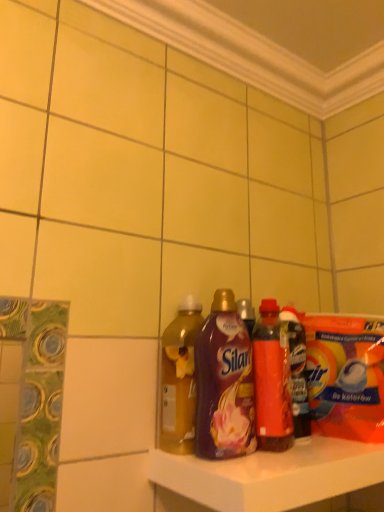
In order to face shiny plastic bottle at center, the 2th bottle when ordered from right to left, should I rotate leftwards or rightwards?

To face it directly, rotate right by 10.706 degrees.

Identify the location of shiny plastic bottle at center, the third bottle when ordered from left to right. Image resolution: width=384 pixels, height=512 pixels. 272,381.

The height and width of the screenshot is (512, 384). I want to click on translucent yellow liquid at center, arranged as the 4th bottle when viewed from the right, so click(x=179, y=379).

From the image's perspective, which one is positioned lower, purple plastic bottle at center, which ranks as the 3th bottle in right-to-left order, or shiny plastic bottle at center, the 2th bottle when ordered from right to left?

shiny plastic bottle at center, the 2th bottle when ordered from right to left, is shown below in the image.

Is purple plastic bottle at center, which ranks as the 3th bottle in right-to-left order, next to shiny plastic bottle at center, the 2th bottle when ordered from right to left?

Yes, purple plastic bottle at center, which ranks as the 3th bottle in right-to-left order, is next to shiny plastic bottle at center, the 2th bottle when ordered from right to left.

How many degrees apart are the facing directions of purple plastic bottle at center, which ranks as the 3th bottle in right-to-left order, and shiny plastic bottle at center, the third bottle when ordered from left to right?

1.74e-05 degrees separate the facing orientations of purple plastic bottle at center, which ranks as the 3th bottle in right-to-left order, and shiny plastic bottle at center, the third bottle when ordered from left to right.

Looking at their sizes, would you say purple plastic bottle at center, which ranks as the 3th bottle in right-to-left order, is wider or thinner than shiny plastic bottle at center, the third bottle when ordered from left to right?

In the image, purple plastic bottle at center, which ranks as the 3th bottle in right-to-left order, appears to be more narrow than shiny plastic bottle at center, the third bottle when ordered from left to right.

How different are the orientations of shiny plastic bottle at center, the 2th bottle when ordered from right to left, and translucent yellow liquid at center, arranged as the 4th bottle when viewed from the right, in degrees?

There is a 1.71e-05-degree angle between the facing directions of shiny plastic bottle at center, the 2th bottle when ordered from right to left, and translucent yellow liquid at center, arranged as the 4th bottle when viewed from the right.

Considering the positions of objects shiny plastic bottle at center, the 2th bottle when ordered from right to left, and translucent yellow liquid at center, placed as the first bottle when sorted from left to right, in the image provided, who is behind, shiny plastic bottle at center, the 2th bottle when ordered from right to left, or translucent yellow liquid at center, placed as the first bottle when sorted from left to right,?

Positioned behind is shiny plastic bottle at center, the 2th bottle when ordered from right to left.

Can we say shiny plastic bottle at center, the 2th bottle when ordered from right to left, lies outside translucent yellow liquid at center, arranged as the 4th bottle when viewed from the right?

Indeed, shiny plastic bottle at center, the 2th bottle when ordered from right to left, is completely outside translucent yellow liquid at center, arranged as the 4th bottle when viewed from the right.

Which bottle is the 1st one when counting from the front of the shiny plastic bottle at center, the third bottle when ordered from left to right? Please provide its 2D coordinates.

[(179, 379)]

Based on the photo, which is closer, (277, 411) or (281, 320)?

The point (277, 411) is more forward.

Is shiny plastic bottle at center, the 2th bottle when ordered from right to left, taller than translucent plastic bottle at center, placed as the 1th bottle when sorted from right to left?

Indeed, shiny plastic bottle at center, the 2th bottle when ordered from right to left, has a greater height compared to translucent plastic bottle at center, placed as the 1th bottle when sorted from right to left.

Considering the sizes of objects shiny plastic bottle at center, the third bottle when ordered from left to right, and translucent plastic bottle at center, placed as the 1th bottle when sorted from right to left, in the image provided, who is wider, shiny plastic bottle at center, the third bottle when ordered from left to right, or translucent plastic bottle at center, placed as the 1th bottle when sorted from right to left,?

With larger width is shiny plastic bottle at center, the third bottle when ordered from left to right.

Is shiny plastic bottle at center, the third bottle when ordered from left to right, placed right next to translucent plastic bottle at center, which is counted as the 4th bottle, starting from the left?

Yes, shiny plastic bottle at center, the third bottle when ordered from left to right, and translucent plastic bottle at center, which is counted as the 4th bottle, starting from the left, clearly make contact.

Identify the location of bottle to the left of purple plastic bottle at center, the second bottle in the left-to-right sequence. (179, 379).

Is translucent yellow liquid at center, arranged as the 4th bottle when viewed from the right, looking in the opposite direction of purple plastic bottle at center, the second bottle in the left-to-right sequence?

No, translucent yellow liquid at center, arranged as the 4th bottle when viewed from the right, is not facing the opposite direction of purple plastic bottle at center, the second bottle in the left-to-right sequence.

From the picture: From a real-world perspective, which object rests below the other?

translucent yellow liquid at center, placed as the first bottle when sorted from left to right, from a real-world perspective.

From the image's perspective, which is above, translucent yellow liquid at center, placed as the first bottle when sorted from left to right, or purple plastic bottle at center, the second bottle in the left-to-right sequence?

purple plastic bottle at center, the second bottle in the left-to-right sequence.

In the image, is translucent plastic bottle at center, which is counted as the 4th bottle, starting from the left, on the left side or the right side of translucent yellow liquid at center, placed as the first bottle when sorted from left to right?

Clearly, translucent plastic bottle at center, which is counted as the 4th bottle, starting from the left, is on the right of translucent yellow liquid at center, placed as the first bottle when sorted from left to right, in the image.

In the scene shown: How many degrees apart are the facing directions of translucent plastic bottle at center, which is counted as the 4th bottle, starting from the left, and translucent yellow liquid at center, placed as the first bottle when sorted from left to right?

0.000131 degrees separate the facing orientations of translucent plastic bottle at center, which is counted as the 4th bottle, starting from the left, and translucent yellow liquid at center, placed as the first bottle when sorted from left to right.

Considering the sizes of translucent plastic bottle at center, placed as the 1th bottle when sorted from right to left, and translucent yellow liquid at center, arranged as the 4th bottle when viewed from the right, in the image, is translucent plastic bottle at center, placed as the 1th bottle when sorted from right to left, taller or shorter than translucent yellow liquid at center, arranged as the 4th bottle when viewed from the right,?

Clearly, translucent plastic bottle at center, placed as the 1th bottle when sorted from right to left, is taller compared to translucent yellow liquid at center, arranged as the 4th bottle when viewed from the right.

Does point (299, 348) come farther from viewer compared to point (175, 438)?

That is True.

How different are the orientations of shiny plastic bottle at center, the third bottle when ordered from left to right, and purple plastic bottle at center, which ranks as the 3th bottle in right-to-left order, in degrees?

There is a 1.74e-05-degree angle between the facing directions of shiny plastic bottle at center, the third bottle when ordered from left to right, and purple plastic bottle at center, which ranks as the 3th bottle in right-to-left order.

Is shiny plastic bottle at center, the 2th bottle when ordered from right to left, in contact with purple plastic bottle at center, which ranks as the 3th bottle in right-to-left order?

Yes, shiny plastic bottle at center, the 2th bottle when ordered from right to left, is beside purple plastic bottle at center, which ranks as the 3th bottle in right-to-left order.

Between shiny plastic bottle at center, the 2th bottle when ordered from right to left, and purple plastic bottle at center, which ranks as the 3th bottle in right-to-left order, which one is positioned behind?

Positioned behind is shiny plastic bottle at center, the 2th bottle when ordered from right to left.

Measure the distance from shiny plastic bottle at center, the third bottle when ordered from left to right, to purple plastic bottle at center, which ranks as the 3th bottle in right-to-left order.

shiny plastic bottle at center, the third bottle when ordered from left to right, and purple plastic bottle at center, which ranks as the 3th bottle in right-to-left order, are 2.89 inches apart.

What's the angular difference between translucent yellow liquid at center, arranged as the 4th bottle when viewed from the right, and shiny plastic bottle at center, the 2th bottle when ordered from right to left,'s facing directions?

The facing directions of translucent yellow liquid at center, arranged as the 4th bottle when viewed from the right, and shiny plastic bottle at center, the 2th bottle when ordered from right to left, are 1.71e-05 degrees apart.

Between translucent yellow liquid at center, placed as the first bottle when sorted from left to right, and shiny plastic bottle at center, the third bottle when ordered from left to right, which one has larger size?

With larger size is shiny plastic bottle at center, the third bottle when ordered from left to right.

From the image's perspective, which one is positioned higher, translucent yellow liquid at center, placed as the first bottle when sorted from left to right, or shiny plastic bottle at center, the 2th bottle when ordered from right to left?

translucent yellow liquid at center, placed as the first bottle when sorted from left to right, from the image's perspective.

From a real-world perspective, between translucent yellow liquid at center, arranged as the 4th bottle when viewed from the right, and shiny plastic bottle at center, the 2th bottle when ordered from right to left, who is vertically higher?

In real-world perspective, shiny plastic bottle at center, the 2th bottle when ordered from right to left, is above.

Where is `bottle that is the 1st object directly below the purple plastic bottle at center, which ranks as the 3th bottle in right-to-left order (from a real-world perspective)`? The image size is (384, 512). bottle that is the 1st object directly below the purple plastic bottle at center, which ranks as the 3th bottle in right-to-left order (from a real-world perspective) is located at coordinates (272, 381).

From a real-world perspective, starting from the translucent yellow liquid at center, placed as the first bottle when sorted from left to right, which bottle is the 2nd one vertically above it? Please provide its 2D coordinates.

[(272, 381)]

Based on their spatial positions, is shiny plastic bottle at center, the 2th bottle when ordered from right to left, or purple plastic bottle at center, which ranks as the 3th bottle in right-to-left order, closer to translucent yellow liquid at center, arranged as the 4th bottle when viewed from the right?

purple plastic bottle at center, which ranks as the 3th bottle in right-to-left order.

Based on their spatial positions, is purple plastic bottle at center, which ranks as the 3th bottle in right-to-left order, or translucent yellow liquid at center, placed as the first bottle when sorted from left to right, further from shiny plastic bottle at center, the third bottle when ordered from left to right?

translucent yellow liquid at center, placed as the first bottle when sorted from left to right, is further to shiny plastic bottle at center, the third bottle when ordered from left to right.

Which object lies further to the anchor point purple plastic bottle at center, which ranks as the 3th bottle in right-to-left order, translucent plastic bottle at center, placed as the 1th bottle when sorted from right to left, or translucent yellow liquid at center, placed as the first bottle when sorted from left to right?

translucent plastic bottle at center, placed as the 1th bottle when sorted from right to left, is further to purple plastic bottle at center, which ranks as the 3th bottle in right-to-left order.

Which object lies further to the anchor point translucent plastic bottle at center, which is counted as the 4th bottle, starting from the left, purple plastic bottle at center, which ranks as the 3th bottle in right-to-left order, or shiny plastic bottle at center, the 2th bottle when ordered from right to left?

purple plastic bottle at center, which ranks as the 3th bottle in right-to-left order, lies further to translucent plastic bottle at center, which is counted as the 4th bottle, starting from the left, than the other object.

Looking at this image, when comparing their distances from translucent yellow liquid at center, placed as the first bottle when sorted from left to right, does purple plastic bottle at center, the second bottle in the left-to-right sequence, or translucent plastic bottle at center, which is counted as the 4th bottle, starting from the left, seem closer?

purple plastic bottle at center, the second bottle in the left-to-right sequence, lies closer to translucent yellow liquid at center, placed as the first bottle when sorted from left to right, than the other object.

Considering their positions, is translucent yellow liquid at center, placed as the first bottle when sorted from left to right, positioned further to purple plastic bottle at center, which ranks as the 3th bottle in right-to-left order, than translucent plastic bottle at center, placed as the 1th bottle when sorted from right to left?

translucent plastic bottle at center, placed as the 1th bottle when sorted from right to left, is positioned further to the anchor purple plastic bottle at center, which ranks as the 3th bottle in right-to-left order.

Looking at this image, from the image, which object appears to be farther from purple plastic bottle at center, the second bottle in the left-to-right sequence, translucent yellow liquid at center, arranged as the 4th bottle when viewed from the right, or shiny plastic bottle at center, the 2th bottle when ordered from right to left?

shiny plastic bottle at center, the 2th bottle when ordered from right to left.

Based on their spatial positions, is translucent yellow liquid at center, arranged as the 4th bottle when viewed from the right, or translucent plastic bottle at center, placed as the 1th bottle when sorted from right to left, closer to shiny plastic bottle at center, the 2th bottle when ordered from right to left?

translucent plastic bottle at center, placed as the 1th bottle when sorted from right to left, lies closer to shiny plastic bottle at center, the 2th bottle when ordered from right to left, than the other object.

This screenshot has width=384, height=512. What are the coordinates of `bottle between purple plastic bottle at center, the second bottle in the left-to-right sequence, and translucent plastic bottle at center, placed as the 1th bottle when sorted from right to left, from left to right` in the screenshot? It's located at (272, 381).

The height and width of the screenshot is (512, 384). Find the location of `bottle between translucent yellow liquid at center, arranged as the 4th bottle when viewed from the right, and shiny plastic bottle at center, the third bottle when ordered from left to right, in the horizontal direction`. bottle between translucent yellow liquid at center, arranged as the 4th bottle when viewed from the right, and shiny plastic bottle at center, the third bottle when ordered from left to right, in the horizontal direction is located at coordinates (224, 383).